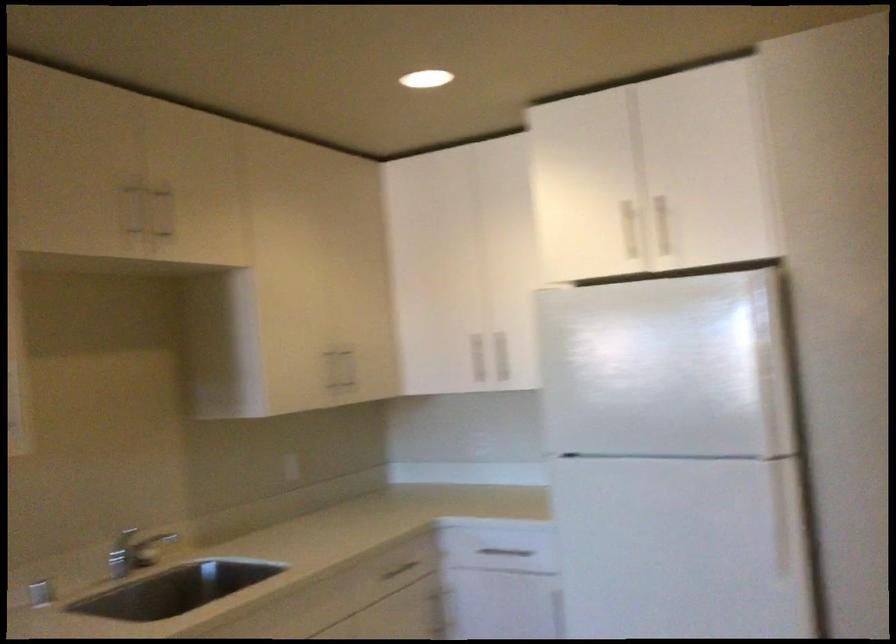
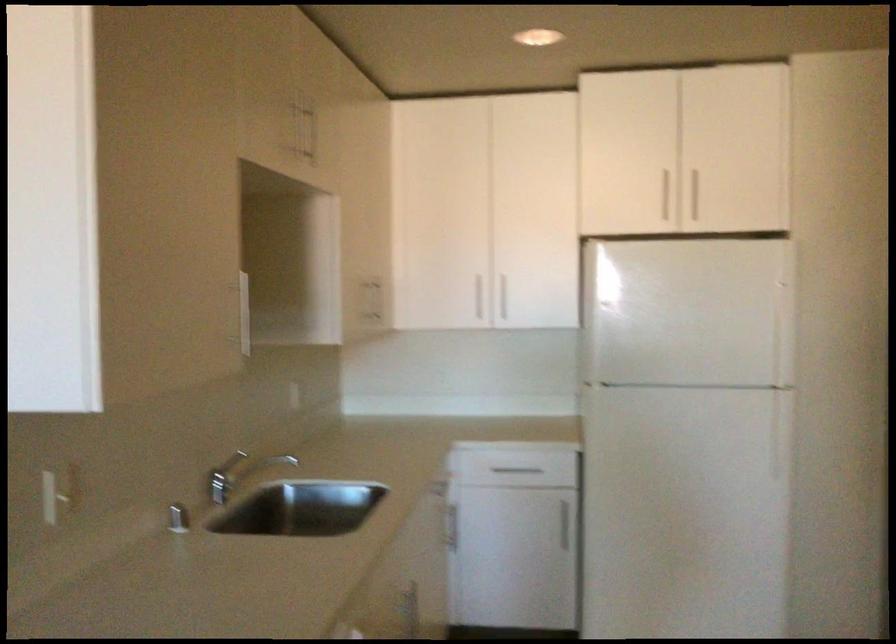
Locate, in the second image, the point that corresponds to [500,357] in the first image.

(506, 298)